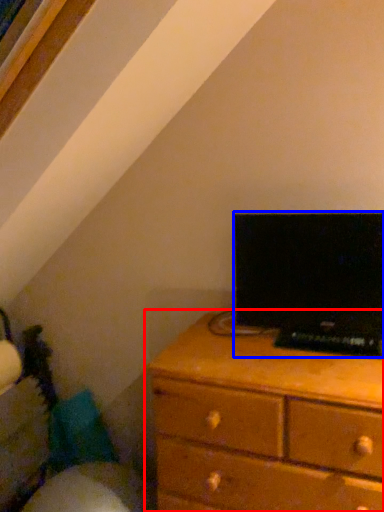
Question: Which point is closer to the camera, chest of drawers (highlighted by a red box) or computer (highlighted by a blue box)?

Choices:
 (A) chest of drawers
 (B) computer

Answer: (A)